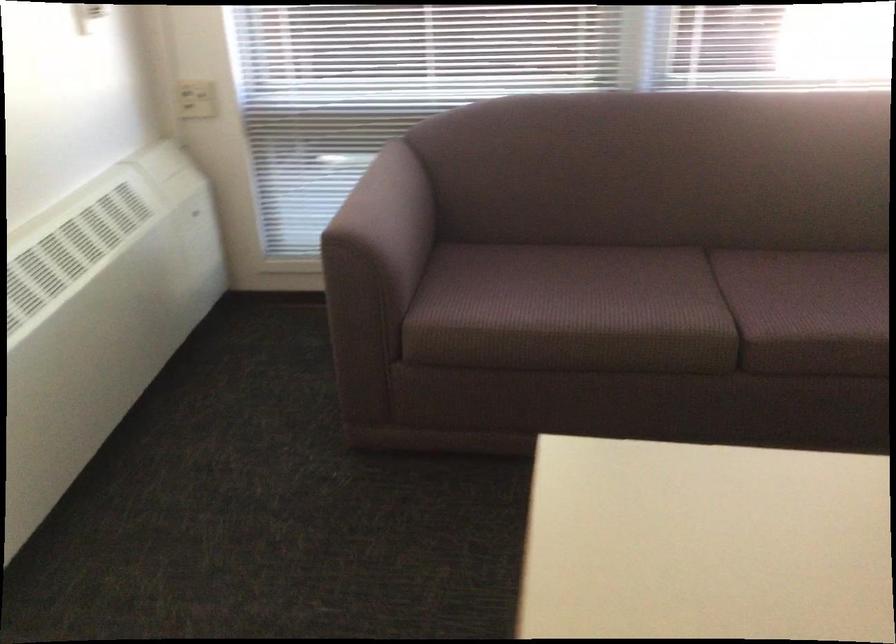
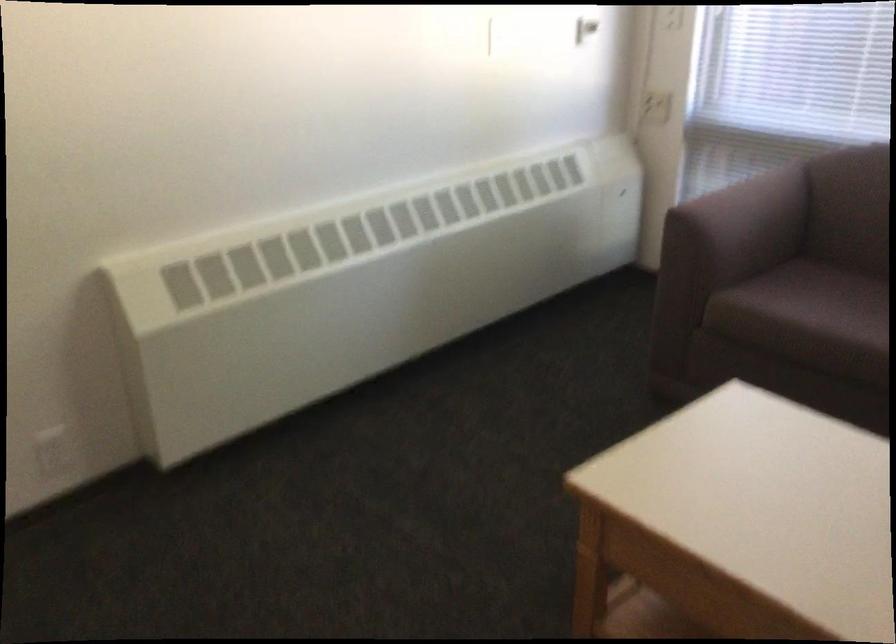
The point at (503,296) is marked in the first image. Where is the corresponding point in the second image?

(807, 303)